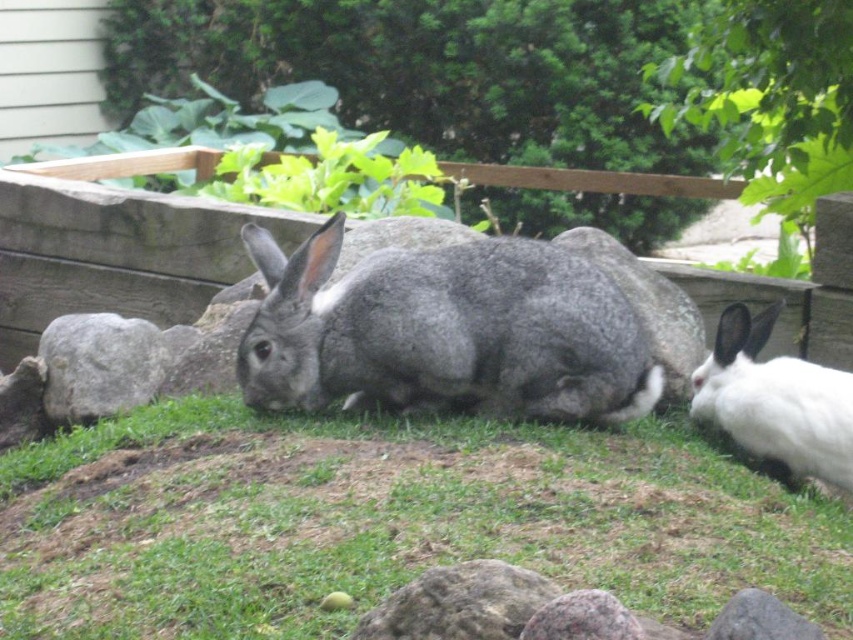
Measure the distance from gray furry rabbit at center to white fluffy rabbit at right.

gray furry rabbit at center and white fluffy rabbit at right are 27.52 inches apart.

Does gray furry rabbit at center come behind white fluffy rabbit at right?

No, it is in front of white fluffy rabbit at right.

Is point (604, 346) positioned before point (801, 445)?

No.

Find the location of a particular element. This screenshot has width=853, height=640. gray furry rabbit at center is located at coordinates (445, 330).

Is point (84, 557) behind point (90, 323)?

No, (84, 557) is closer to viewer.

Is green grass at lower center positioned behind gray rough stone at lower left?

No, green grass at lower center is closer to the viewer.

Identify the location of green grass at lower center. The height and width of the screenshot is (640, 853). (386, 522).

Which of these two, green grass at lower center or white fluffy rabbit at right, stands shorter?

With less height is green grass at lower center.

Locate an element on the screen. green grass at lower center is located at coordinates (386, 522).

Locate an element on the screen. green grass at lower center is located at coordinates (386, 522).